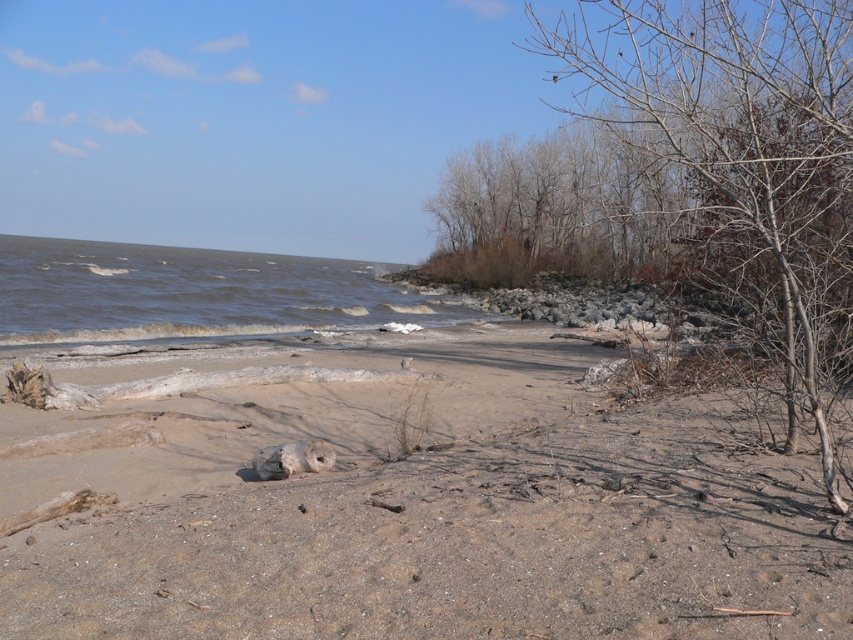
Question: Which of these objects is positioned farthest from the bare branches at right?

Choices:
 (A) brown sandy beach at center
 (B) white sandstone at center

Answer: (B)

Question: Is brown sandy beach at center below bare branches at right?

Choices:
 (A) no
 (B) yes

Answer: (B)

Question: Can you confirm if brown sandy beach at center is wider than dark gray water at lower left?

Choices:
 (A) yes
 (B) no

Answer: (B)

Question: Among these objects, which one is farthest from the camera?

Choices:
 (A) brown sandy beach at center
 (B) bare branches at right
 (C) white sandstone at center
 (D) dark gray water at lower left

Answer: (D)

Question: Is dark gray water at lower left to the right of white sandstone at center from the viewer's perspective?

Choices:
 (A) no
 (B) yes

Answer: (A)

Question: Which of these objects is positioned closest to the bare branches at right?

Choices:
 (A) white sandstone at center
 (B) dark gray water at lower left

Answer: (B)